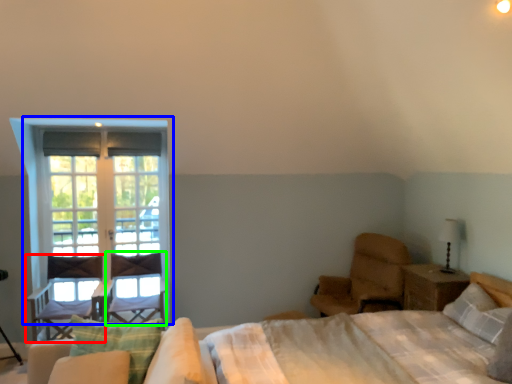
Question: Which object is positioned farthest from chair (highlighted by a red box)? Select from window (highlighted by a blue box) and swivel chair (highlighted by a green box).

Choices:
 (A) window
 (B) swivel chair

Answer: (A)